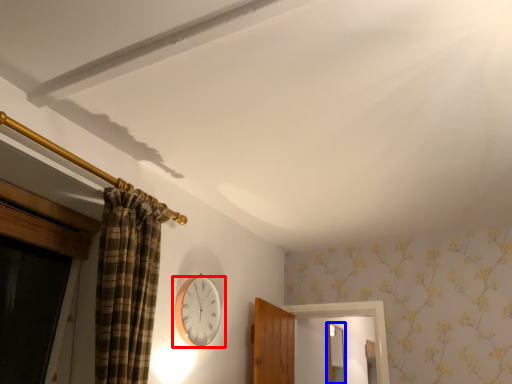
Question: Which object appears closest to the camera in this image, wall clock (highlighted by a red box) or mirror (highlighted by a blue box)?

Choices:
 (A) wall clock
 (B) mirror

Answer: (A)